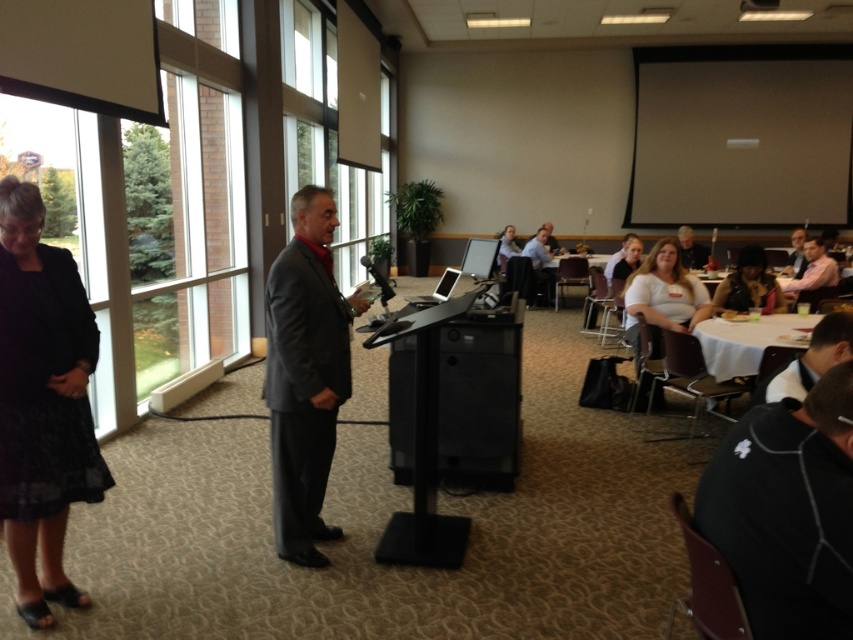
This screenshot has width=853, height=640. Describe the element at coordinates (664, 294) in the screenshot. I see `white matte shirt at center` at that location.

Is white matte shirt at center taller than smooth brown leather jacket at upper right?

Indeed, white matte shirt at center has a greater height compared to smooth brown leather jacket at upper right.

Does point (660, 280) come farther from viewer compared to point (801, 253)?

No, it is not.

I want to click on white matte shirt at center, so click(664, 294).

Does matte black hair at center lie behind smooth brown leather jacket at upper right?

No, it is not.

Locate an element on the screen. The height and width of the screenshot is (640, 853). matte black hair at center is located at coordinates (747, 284).

Between black textured dress at left and matte black hair at center, which one appears on the left side from the viewer's perspective?

From the viewer's perspective, black textured dress at left appears more on the left side.

The height and width of the screenshot is (640, 853). Describe the element at coordinates (42, 403) in the screenshot. I see `black textured dress at left` at that location.

Identify the location of black textured dress at left. (42, 403).